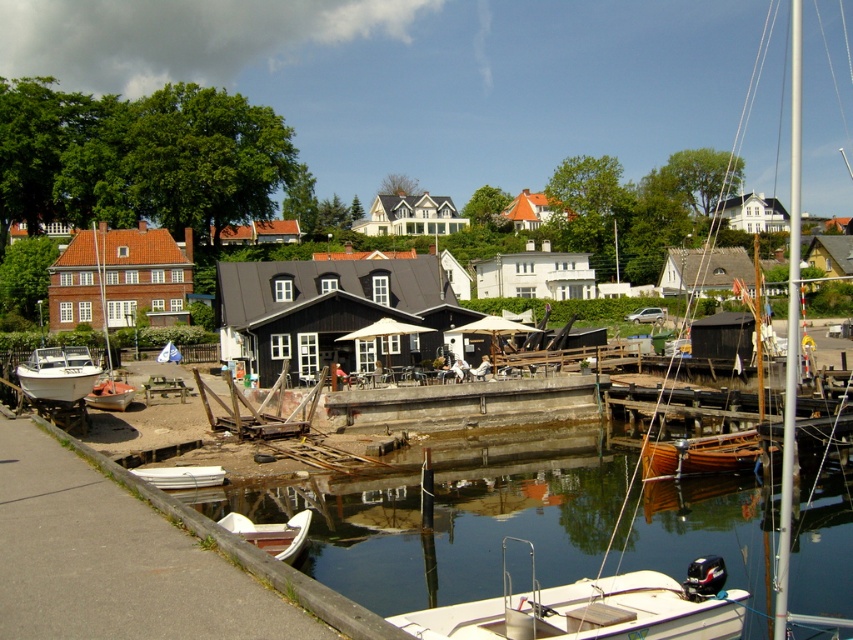
Question: Which object appears closest to the camera in this image?

Choices:
 (A) white plastic boat at lower center
 (B) smooth concrete dock at lower center
 (C) wooden boat at lower right
 (D) white wooden boat at lower center

Answer: (B)

Question: Can you confirm if concrete at center is thinner than white matte boat at lower left?

Choices:
 (A) yes
 (B) no

Answer: (B)

Question: Which of the following is the closest to the observer?

Choices:
 (A) smooth concrete dock at lower center
 (B) white matte boat at lower left
 (C) white matte boat at left
 (D) white wooden boat at lower center

Answer: (A)

Question: Does wooden boat at lower right appear on the right side of white matte boat at lower left?

Choices:
 (A) no
 (B) yes

Answer: (B)

Question: Which object is the farthest from the white plastic boat at lower center?

Choices:
 (A) smooth concrete dock at lower center
 (B) white matte boat at left

Answer: (B)

Question: Is white matte boat at lower left closer to camera compared to metallic silver boat at lower left?

Choices:
 (A) no
 (B) yes

Answer: (B)